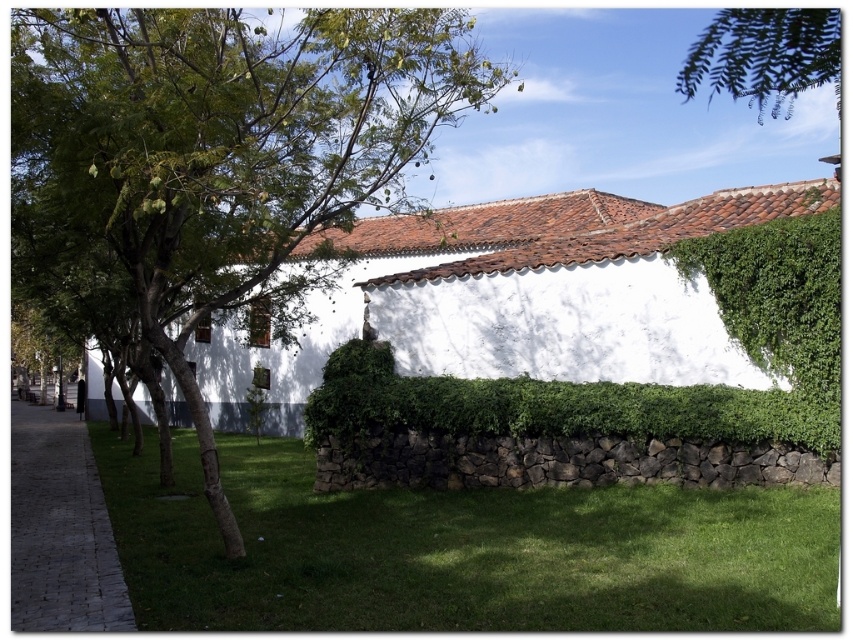
Is paved stone sidewalk at lower left below green leafy branch at upper right?

Yes, paved stone sidewalk at lower left is below green leafy branch at upper right.

Does point (22, 598) come behind point (793, 29)?

Yes, it is behind point (793, 29).

At what (x,y) coordinates should I click in order to perform the action: click on paved stone sidewalk at lower left. Please return your answer as a coordinate pair (x, y). Looking at the image, I should click on (61, 529).

Which is behind, point (700, 598) or point (334, 404)?

Positioned behind is point (334, 404).

Which is below, green grass at lower center or green leafy hedge at center?

green grass at lower center is below.

Who is more distant from viewer, (381, 579) or (534, 438)?

The point (534, 438) is more distant.

Find the location of a particular element. green grass at lower center is located at coordinates (459, 550).

Who is taller, green leafy tree at center or green leafy branch at upper right?

With more height is green leafy branch at upper right.

Consider the image. Who is more distant from viewer, (99,22) or (743,54)?

Point (99,22)

Find the location of a particular element. The width and height of the screenshot is (853, 640). green leafy tree at center is located at coordinates (230, 147).

At what (x,y) coordinates should I click in order to perform the action: click on green leafy tree at center. Please return your answer as a coordinate pair (x, y). Image resolution: width=853 pixels, height=640 pixels. Looking at the image, I should click on (230, 147).